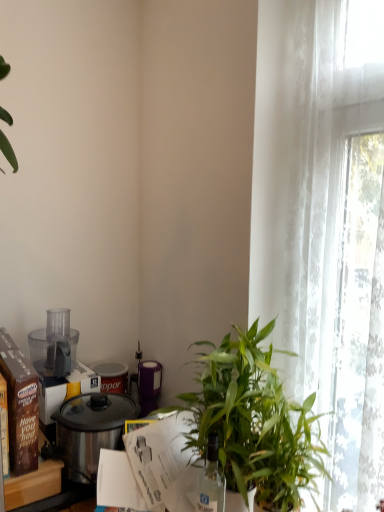
Identify the location of matte brown box at left, which is counted as the first box, starting from the back. (20, 406).

What do you see at coordinates (20, 406) in the screenshot? I see `matte brown box at left, which appears as the 2th box when viewed from the front` at bounding box center [20, 406].

In order to click on green leafy plant at center in this screenshot , I will do 255,422.

Describe the element at coordinates (54, 345) in the screenshot. I see `transparent plastic food processor at left` at that location.

The width and height of the screenshot is (384, 512). What do you see at coordinates (211, 481) in the screenshot? I see `transparent glass bottle at center` at bounding box center [211, 481].

You are a GUI agent. You are given a task and a screenshot of the screen. Output one action in this format:
    pyautogui.click(x=<x>, y=<y>)
    Task: Click on the matte brown box at left, which appears as the 2th box when viewed from the front
    This screenshot has height=512, width=384.
    Given the screenshot: What is the action you would take?
    pyautogui.click(x=20, y=406)

The height and width of the screenshot is (512, 384). Find the location of `kitchen appliance behind the brown cardboard box at left`. kitchen appliance behind the brown cardboard box at left is located at coordinates (54, 345).

In the scene shown: Between transparent plastic food processor at left and brown cardboard box at left, which one has smaller width?

brown cardboard box at left.

Is transparent plastic food processor at left located outside brown cardboard box at left?

Yes, transparent plastic food processor at left is located beyond the bounds of brown cardboard box at left.

Is transparent plastic food processor at left further to camera compared to brown cardboard box at left?

Yes, it is.

From a real-world perspective, is matte brown box at left, which is counted as the first box, starting from the back, located beneath white sheer curtain at right?

Correct, in the physical world, matte brown box at left, which is counted as the first box, starting from the back, is lower than white sheer curtain at right.

Considering the relative positions of matte brown box at left, which appears as the 2th box when viewed from the front, and white sheer curtain at right in the image provided, is matte brown box at left, which appears as the 2th box when viewed from the front, in front of white sheer curtain at right?

No, matte brown box at left, which appears as the 2th box when viewed from the front, is behind white sheer curtain at right.

Looking at this image, based on their sizes in the image, would you say matte brown box at left, which is counted as the first box, starting from the back, is bigger or smaller than white sheer curtain at right?

In the image, matte brown box at left, which is counted as the first box, starting from the back, appears to be smaller than white sheer curtain at right.

Is transparent plastic food processor at left inside brown cardboard box at left, which appears as the first box when viewed from the front?

Actually, transparent plastic food processor at left is outside brown cardboard box at left, which appears as the first box when viewed from the front.

From the picture: Is brown cardboard box at left, which appears as the first box when viewed from the front, aimed at transparent plastic food processor at left?

No, brown cardboard box at left, which appears as the first box when viewed from the front, is not aimed at transparent plastic food processor at left.

From the image's perspective, is brown cardboard box at left, which appears as the first box when viewed from the front, located beneath transparent plastic food processor at left?

Yes, from the image's perspective, brown cardboard box at left, which appears as the first box when viewed from the front, is beneath transparent plastic food processor at left.

Is brown cardboard box at left, arranged as the second box when viewed from the back, at the left side of transparent plastic food processor at left?

Correct, you'll find brown cardboard box at left, arranged as the second box when viewed from the back, to the left of transparent plastic food processor at left.

What's the angular difference between transparent plastic food processor at left and transparent glass bottle at center's facing directions?

They differ by 85.3 degrees in their facing directions.

Based on the photo, from the image's perspective, is transparent plastic food processor at left below transparent glass bottle at center?

No.

Which is closer to the camera, (36, 356) or (204, 481)?

Point (36, 356) is farther from the camera than point (204, 481).

Find the location of a particular element. This screenshot has height=512, width=384. bottle below the transparent plastic food processor at left (from the image's perspective) is located at coordinates (211, 481).

Which is correct: white sheer curtain at right is inside green leafy plant at center, or outside of it?

white sheer curtain at right cannot be found inside green leafy plant at center.

Is white sheer curtain at right taller than green leafy plant at center?

Yes.

Is green leafy plant at center at the back of white sheer curtain at right?

Yes, white sheer curtain at right's orientation is away from green leafy plant at center.

Based on the photo, considering the positions of objects white sheer curtain at right and green leafy plant at center in the image provided, who is more to the right, white sheer curtain at right or green leafy plant at center?

From the viewer's perspective, white sheer curtain at right appears more on the right side.

Is white sheer curtain at right facing away from brown cardboard box at left?

No, white sheer curtain at right is not facing away from brown cardboard box at left.

At what (x,y) coordinates should I click in order to perform the action: click on shelf on the left of white sheer curtain at right. Please return your answer as a coordinate pair (x, y). Looking at the image, I should click on (33, 485).

Is white sheer curtain at right far away from brown cardboard box at left?

No, there isn't a large distance between white sheer curtain at right and brown cardboard box at left.

Does brown cardboard box at left have a lesser height compared to brown cardboard box at left, arranged as the second box when viewed from the back?

Yes, brown cardboard box at left is shorter than brown cardboard box at left, arranged as the second box when viewed from the back.

Which of these two, brown cardboard box at left or brown cardboard box at left, which appears as the first box when viewed from the front, is thinner?

brown cardboard box at left, which appears as the first box when viewed from the front.

Is brown cardboard box at left behind brown cardboard box at left, which appears as the first box when viewed from the front?

Yes, brown cardboard box at left is further from the viewer.

From the picture: Choose the correct answer: Is brown cardboard box at left inside brown cardboard box at left, arranged as the second box when viewed from the back, or outside it?

brown cardboard box at left is not inside brown cardboard box at left, arranged as the second box when viewed from the back, it's outside.

At what (x,y) coordinates should I click in order to perform the action: click on shelf located underneath the transparent plastic food processor at left (from a real-world perspective). Please return your answer as a coordinate pair (x, y). The width and height of the screenshot is (384, 512). Looking at the image, I should click on (33, 485).

Where is `curtain above the matte brown box at left, which is counted as the first box, starting from the back (from the image's perspective)`? curtain above the matte brown box at left, which is counted as the first box, starting from the back (from the image's perspective) is located at coordinates (328, 243).

Which object lies nearer to the anchor point brown cardboard box at left, brown cardboard box at left, which appears as the first box when viewed from the front, or white sheer curtain at right?

brown cardboard box at left, which appears as the first box when viewed from the front, is closer to brown cardboard box at left.

Considering their positions, is white sheer curtain at right positioned further to brown cardboard box at left than shiny metallic pot at lower left?

white sheer curtain at right lies further to brown cardboard box at left than the other object.

Based on their spatial positions, is green leafy plant at center or brown cardboard box at left, arranged as the second box when viewed from the back, closer to matte brown box at left, which appears as the 2th box when viewed from the front?

brown cardboard box at left, arranged as the second box when viewed from the back, is positioned closer to the anchor matte brown box at left, which appears as the 2th box when viewed from the front.

Looking at the image, which one is located further to transparent plastic food processor at left, brown cardboard box at left or shiny metallic pot at lower left?

brown cardboard box at left is further to transparent plastic food processor at left.

From the picture: Looking at the image, which one is located closer to shiny metallic pot at lower left, white sheer curtain at right or brown cardboard box at left?

Among the two, brown cardboard box at left is located nearer to shiny metallic pot at lower left.

Based on their spatial positions, is brown cardboard box at left or brown cardboard box at left, which appears as the first box when viewed from the front, closer to green leafy plant at center?

brown cardboard box at left is positioned closer to the anchor green leafy plant at center.

Based on their spatial positions, is transparent plastic food processor at left or green leafy plant at center further from brown cardboard box at left, which appears as the first box when viewed from the front?

Based on the image, green leafy plant at center appears to be further to brown cardboard box at left, which appears as the first box when viewed from the front.

From the image, which object appears to be nearer to transparent plastic food processor at left, matte brown box at left, which is counted as the first box, starting from the back, or green leafy plant at center?

Based on the image, matte brown box at left, which is counted as the first box, starting from the back, appears to be nearer to transparent plastic food processor at left.

Where is `box situated between matte brown box at left, which is counted as the first box, starting from the back, and shiny metallic pot at lower left from left to right`? The height and width of the screenshot is (512, 384). box situated between matte brown box at left, which is counted as the first box, starting from the back, and shiny metallic pot at lower left from left to right is located at coordinates (4, 426).

The width and height of the screenshot is (384, 512). Find the location of `bottle between matte brown box at left, which is counted as the first box, starting from the back, and white sheer curtain at right, in the horizontal direction`. bottle between matte brown box at left, which is counted as the first box, starting from the back, and white sheer curtain at right, in the horizontal direction is located at coordinates (211, 481).

Find the location of a particular element. The height and width of the screenshot is (512, 384). pot/pan between matte brown box at left, which appears as the 2th box when viewed from the front, and white sheer curtain at right, in the horizontal direction is located at coordinates (90, 431).

Where is `box between matte brown box at left, which appears as the 2th box when viewed from the front, and white sheer curtain at right, in the horizontal direction`? Image resolution: width=384 pixels, height=512 pixels. box between matte brown box at left, which appears as the 2th box when viewed from the front, and white sheer curtain at right, in the horizontal direction is located at coordinates (4, 426).